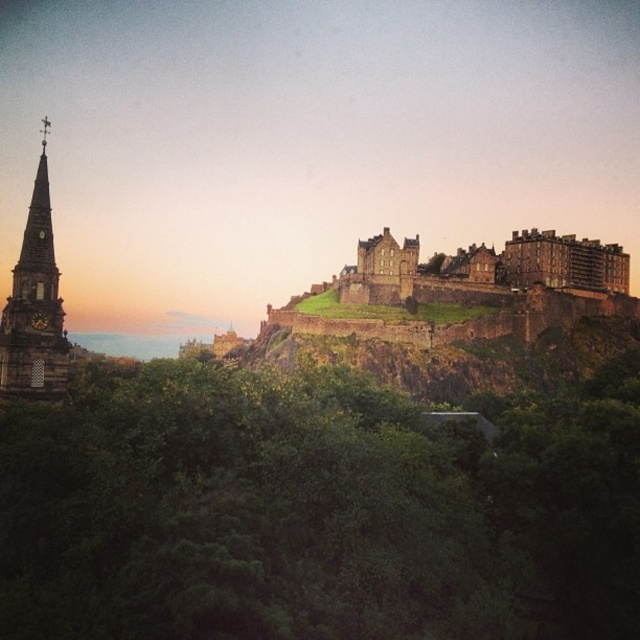
You are a GUI agent. You are given a task and a screenshot of the screen. Output one action in this format:
    pyautogui.click(x=<x>, y=<y>)
    Task: Click on the green leafy tree at center
    The width and height of the screenshot is (640, 640).
    Given the screenshot: What is the action you would take?
    pyautogui.click(x=316, y=509)

What do you see at coordinates (316, 509) in the screenshot? The height and width of the screenshot is (640, 640). I see `green leafy tree at center` at bounding box center [316, 509].

Between point (454, 580) and point (49, 260), which one is positioned in front?

Point (454, 580)

Find the location of a particular element. green leafy tree at center is located at coordinates (316, 509).